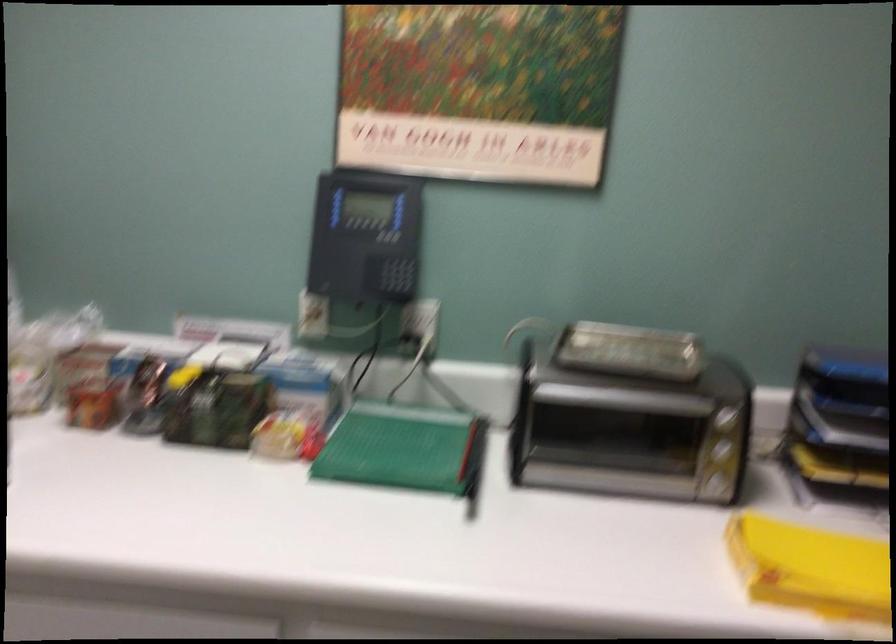
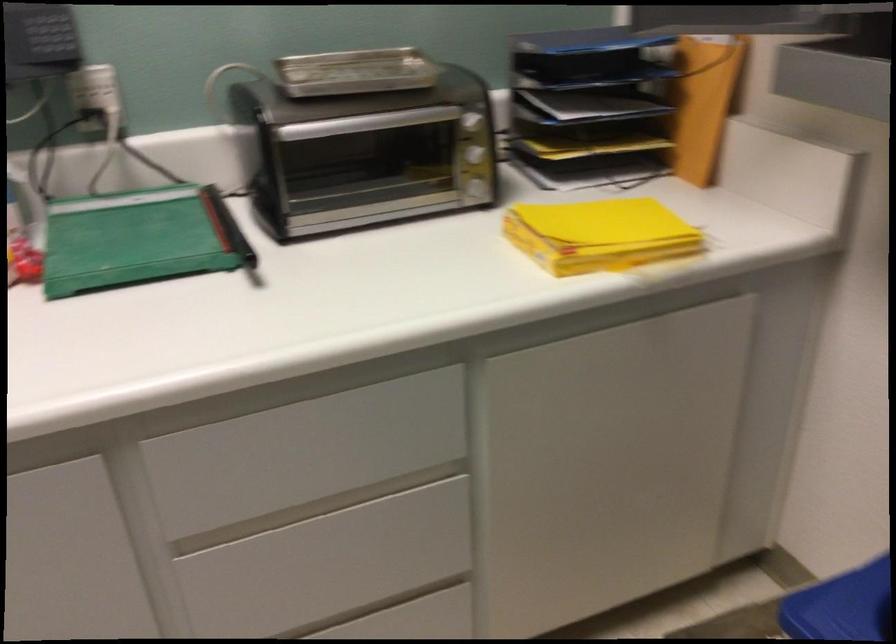
Find the pixel in the second image that matches pixel 721 488 in the first image.

(478, 190)